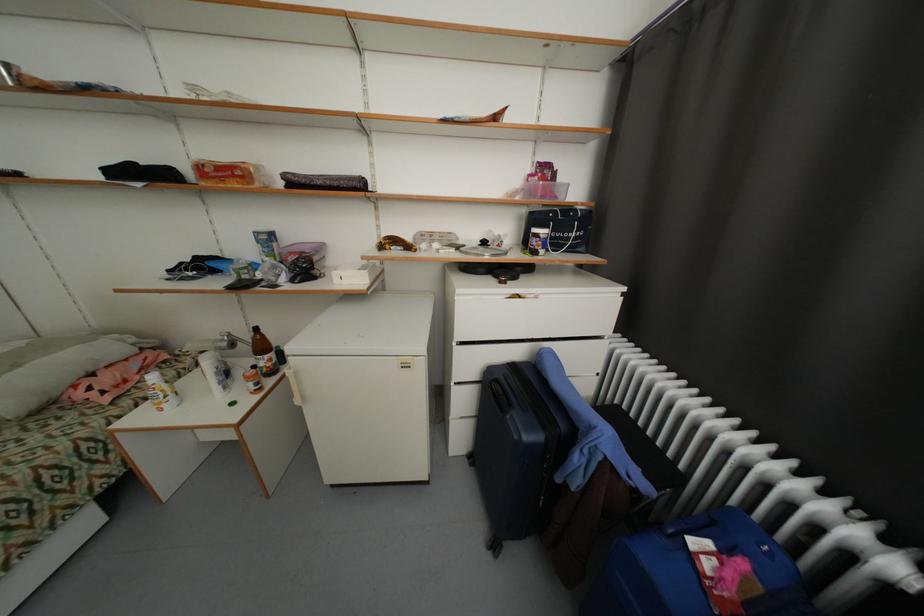
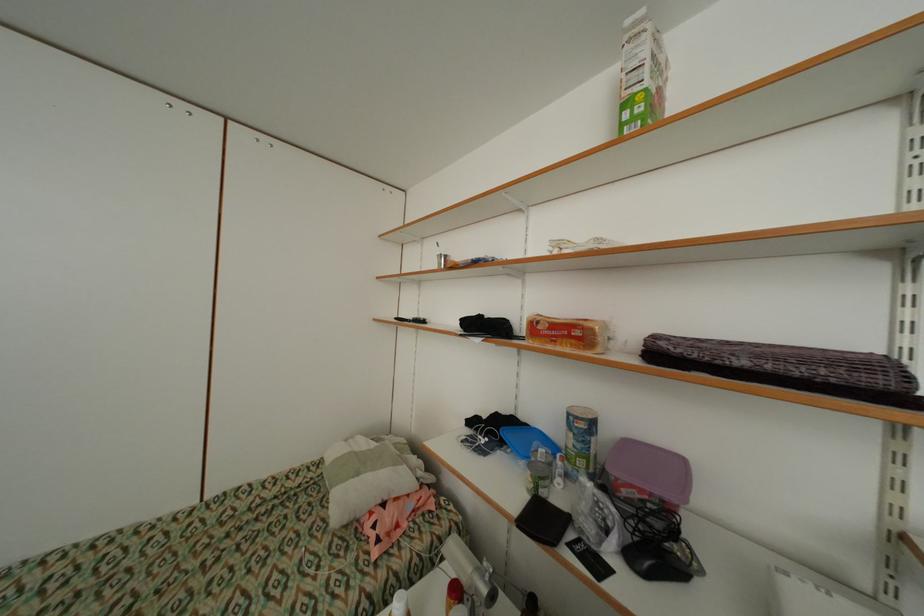
The first image is from the beginning of the video and the second image is from the end. How did the camera likely rotate when shooting the video?

The camera's rotation is toward left-up.